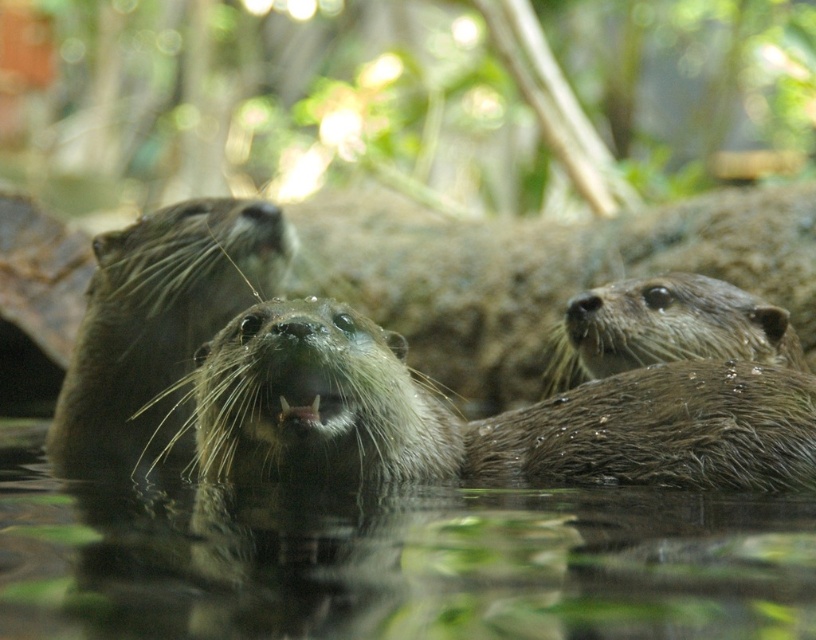
Question: Which of the following is the farthest from the observer?

Choices:
 (A) (420, 515)
 (B) (202, 374)

Answer: (B)

Question: From the image, what is the correct spatial relationship of clear water at center in relation to fuzzy brown otter at center?

Choices:
 (A) above
 (B) below

Answer: (B)

Question: Does clear water at center appear over fuzzy brown otter at center?

Choices:
 (A) no
 (B) yes

Answer: (A)

Question: Which of the following is the closest to the observer?

Choices:
 (A) clear water at center
 (B) fuzzy brown otter at center

Answer: (A)

Question: Is clear water at center further to camera compared to fuzzy brown otter at center?

Choices:
 (A) yes
 (B) no

Answer: (B)